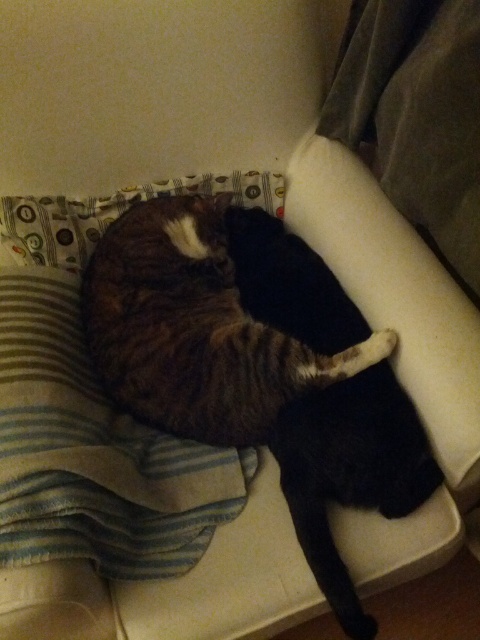
You are a cat owner who wants to place a small toy between the striped fleece blanket at lower left and the tabby fur cat at center. Can you fit the toy there if it requires 6 inches of space?

The striped fleece blanket at lower left and the tabby fur cat at center are 5.88 inches apart. Since the required space for the toy is 6 inches, which is more than the available 5.88 inches, the toy cannot fit between them.

You are a cat owner who wants to place a new toy for your cats. The cats are currently resting on a cushioned surface with a striped fabric and a patterned fabric with circular designs. You have a small toy that needs to be placed at point (94, 452). What object will the toy be placed on?

The toy will be placed on the striped fleece blanket at lower left located at point (94, 452).